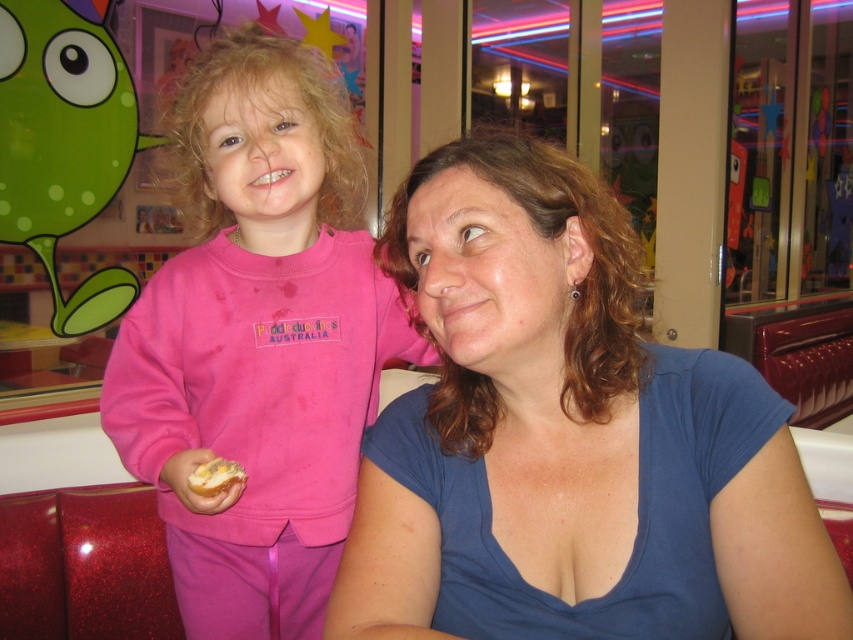
You are a delivery person who needs to place a small note between the blue cotton shirt at center and the yellowish bread at lower left. The note is 2 inches wide. Can you fit the note between them without moving either object?

The blue cotton shirt at center is 11.73 inches away from the yellowish bread at lower left, so yes, the 2 inch wide note can fit between them since the distance is greater than the note width.